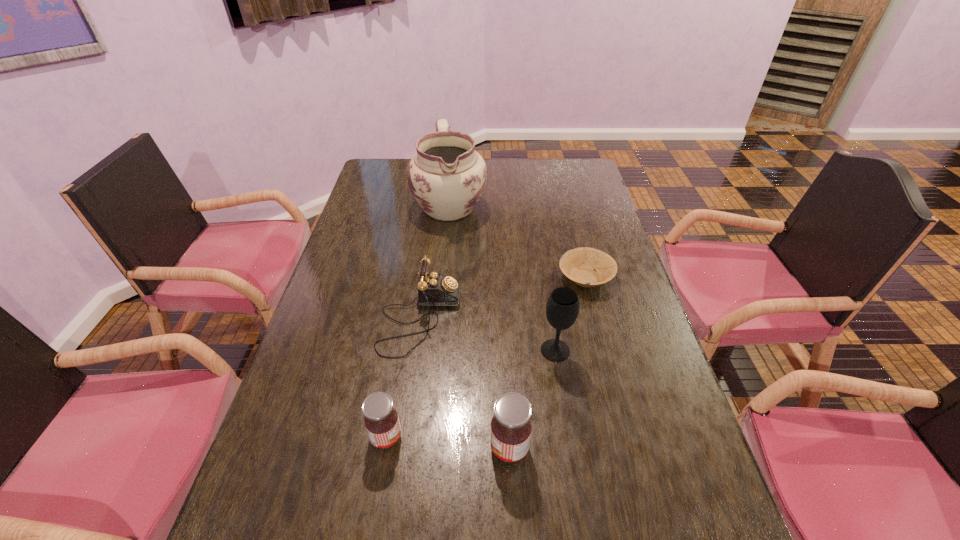
What are the coordinates of `the left jam` in the screenshot? It's located at (381, 420).

Where is `the third tallest object`? This screenshot has height=540, width=960. the third tallest object is located at coordinates (511, 427).

Where is `the right jam`? the right jam is located at coordinates (511, 427).

Where is `telephone`? This screenshot has width=960, height=540. telephone is located at coordinates (434, 289).

The width and height of the screenshot is (960, 540). What are the coordinates of `pitcher` in the screenshot? It's located at (446, 176).

Locate an element on the screen. The image size is (960, 540). the farthest object is located at coordinates (446, 176).

You are a GUI agent. You are given a task and a screenshot of the screen. Output one action in this format:
    pyautogui.click(x=<x>, y=<y>)
    Task: Click on the fifth object from left to right
    The height and width of the screenshot is (540, 960).
    Given the screenshot: What is the action you would take?
    pos(562,308)

This screenshot has height=540, width=960. Find the location of `the second tallest object`. the second tallest object is located at coordinates (562, 308).

Where is `the shortest object`? The image size is (960, 540). the shortest object is located at coordinates (578, 264).

This screenshot has height=540, width=960. Identify the location of bowl. (578, 264).